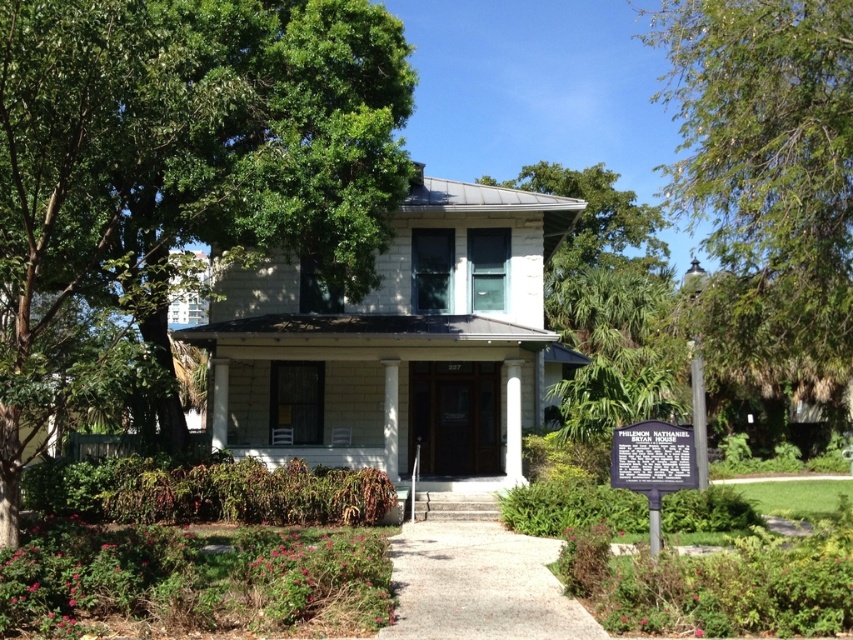
Question: Estimate the real-world distances between objects in this image. Which object is closer to the white wood column at center?

Choices:
 (A) black metal sign at lower center
 (B) green leafy tree at upper left
 (C) white smooth column at center

Answer: (C)

Question: Is green leafy tree at right bigger than white smooth column at center?

Choices:
 (A) no
 (B) yes

Answer: (B)

Question: Is the position of green leafy tree at right more distant than that of green leafy tree at upper center?

Choices:
 (A) yes
 (B) no

Answer: (B)

Question: Estimate the real-world distances between objects in this image. Which object is farther from the green leafy tree at upper left?

Choices:
 (A) white wood column at center
 (B) white smooth column at center

Answer: (B)

Question: Is green leafy tree at upper left further to the viewer compared to white wood column at center?

Choices:
 (A) yes
 (B) no

Answer: (B)

Question: Which object is farther from the camera taking this photo?

Choices:
 (A) white smooth column at center
 (B) black metal sign at lower center
 (C) white wood column at center

Answer: (C)